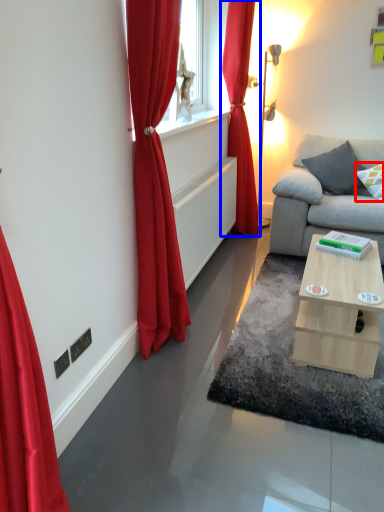
Question: Which object appears closest to the camera in this image, pillow (highlighted by a red box) or curtain (highlighted by a blue box)?

Choices:
 (A) pillow
 (B) curtain

Answer: (B)